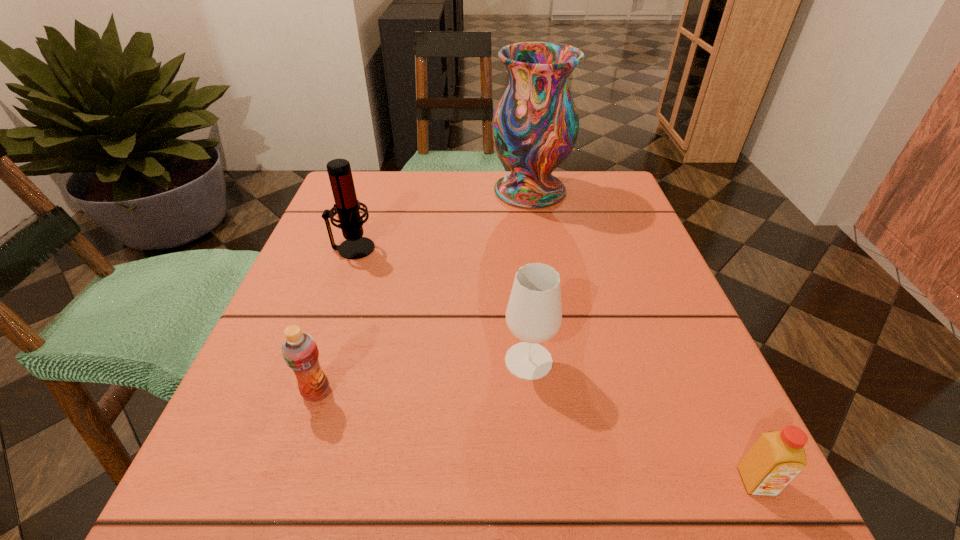
Locate an element on the screen. The image size is (960, 540). vacant area located on the front of the glass is located at coordinates (544, 509).

You are a GUI agent. You are given a task and a screenshot of the screen. Output one action in this format:
    pyautogui.click(x=<x>, y=<y>)
    Task: Click on the free region located 0.300m on the back of the taller orange juice
    
    Given the screenshot: What is the action you would take?
    pyautogui.click(x=361, y=255)

The width and height of the screenshot is (960, 540). In order to click on object that is at the far edge in this screenshot , I will do `click(535, 125)`.

You are a GUI agent. You are given a task and a screenshot of the screen. Output one action in this format:
    pyautogui.click(x=<x>, y=<y>)
    Task: Click on the object positioned at the near edge
    
    Given the screenshot: What is the action you would take?
    coord(776,458)

You are a GUI agent. You are given a task and a screenshot of the screen. Output one action in this format:
    pyautogui.click(x=<x>, y=<y>)
    Task: Click on the microphone positioned at the left edge
    The width and height of the screenshot is (960, 540).
    Given the screenshot: What is the action you would take?
    pyautogui.click(x=347, y=206)

This screenshot has height=540, width=960. Find the location of `orange juice at the left edge`. orange juice at the left edge is located at coordinates (300, 352).

Identify the location of vase that is at the right edge. This screenshot has width=960, height=540. (535, 125).

Where is `orange juice that is at the right edge`? orange juice that is at the right edge is located at coordinates (776, 458).

Find the location of `object that is at the far right corner`. object that is at the far right corner is located at coordinates (535, 125).

Find the location of `object situated at the near right corner`. object situated at the near right corner is located at coordinates (776, 458).